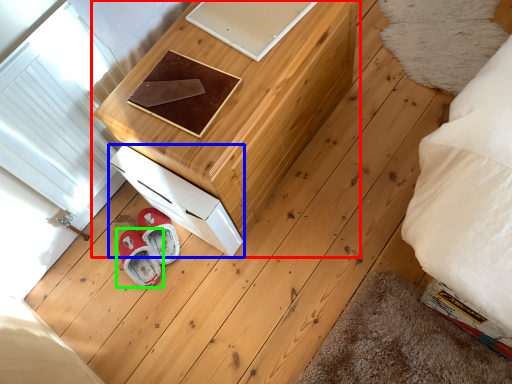
Question: Considering the real-world distances, which object is closest to furniture (highlighted by a red box)? drawer (highlighted by a blue box) or footwear (highlighted by a green box).

Choices:
 (A) drawer
 (B) footwear

Answer: (A)